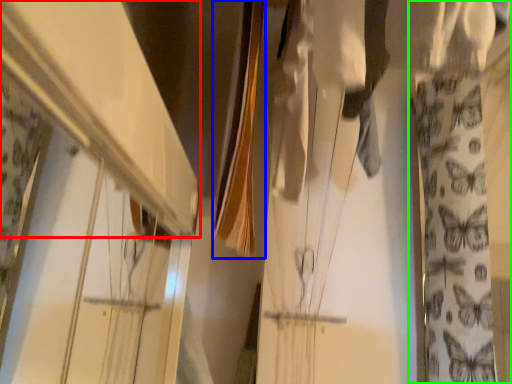
Question: Which object is positioned closest to shelf (highlighted by a red box)? Select from clothesline (highlighted by a blue box) and curtain (highlighted by a green box).

Choices:
 (A) clothesline
 (B) curtain

Answer: (A)